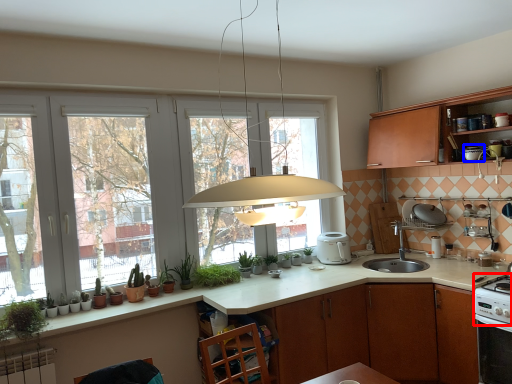
Question: Which object appears farthest to the camera in this image, gas stove (highlighted by a red box) or appliance (highlighted by a blue box)?

Choices:
 (A) gas stove
 (B) appliance

Answer: (B)